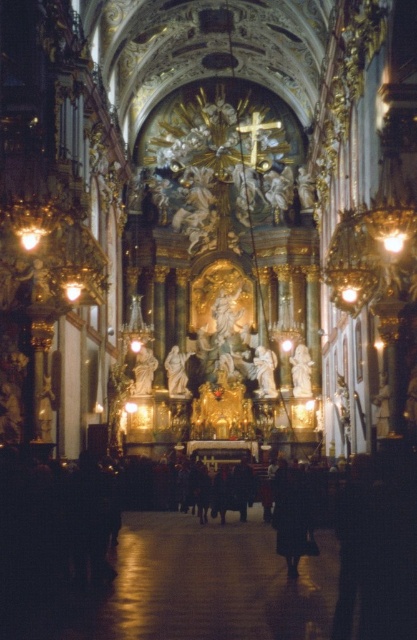
Question: Which of the following is the farthest from the observer?

Choices:
 (A) white marble statue at center
 (B) dark matte coat at center

Answer: (A)

Question: Does dark matte coat at center appear on the right side of white marble statue at center?

Choices:
 (A) yes
 (B) no

Answer: (A)

Question: Is dark matte coat at center bigger than white marble statue at center?

Choices:
 (A) yes
 (B) no

Answer: (A)

Question: Which of the following is the farthest from the observer?

Choices:
 (A) (303, 488)
 (B) (178, 356)

Answer: (B)

Question: Is dark matte coat at center thinner than white marble statue at center?

Choices:
 (A) yes
 (B) no

Answer: (B)